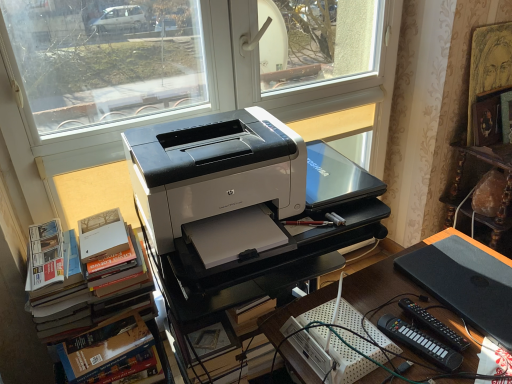
Where is `free spot to the right of black plastic remote control at lower right, which ranks as the 2th equipment in left-to-right order`? The height and width of the screenshot is (384, 512). free spot to the right of black plastic remote control at lower right, which ranks as the 2th equipment in left-to-right order is located at coordinates (470, 324).